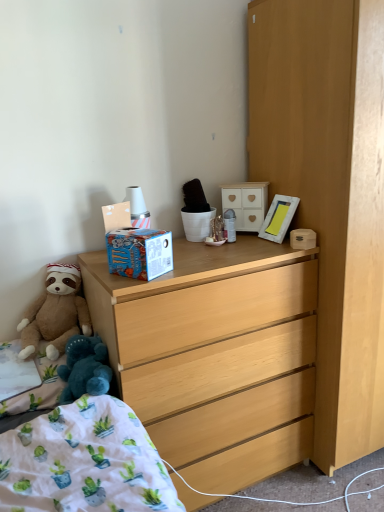
Identify the location of vacant space situated on the left part of white wooden picture frame at upper right. (244, 244).